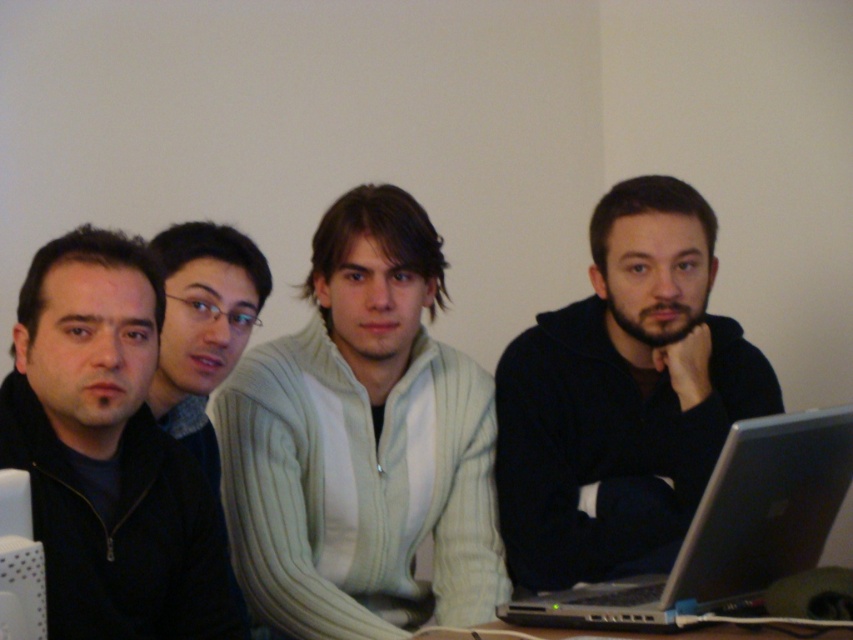
Question: Which point is farther from the camera taking this photo?

Choices:
 (A) click(x=618, y=563)
 (B) click(x=816, y=449)
 (C) click(x=167, y=472)

Answer: (A)

Question: Does matte gray sweater at center lie in front of white plastic computer at lower left?

Choices:
 (A) no
 (B) yes

Answer: (A)

Question: Does black matte jacket at center appear under matte gray sweater at center?

Choices:
 (A) no
 (B) yes

Answer: (B)

Question: Is white knit sweater at center thinner than dark matte jacket at left?

Choices:
 (A) no
 (B) yes

Answer: (A)

Question: Among these objects, which one is farthest from the camera?

Choices:
 (A) black matte jacket at center
 (B) white knit sweater at center
 (C) matte gray sweater at center

Answer: (A)

Question: Estimate the real-world distances between objects in this image. Which object is farther from the white plastic computer at lower left?

Choices:
 (A) dark matte jacket at left
 (B) matte gray sweater at center

Answer: (B)